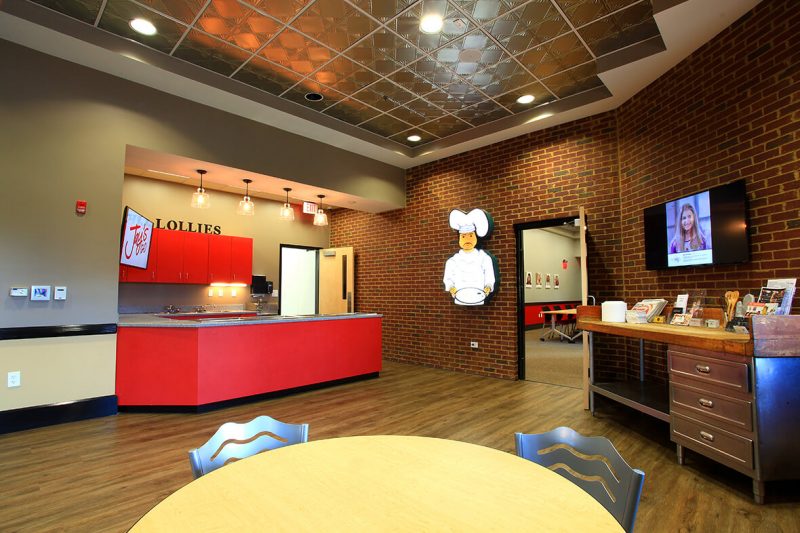
The image size is (800, 533). In order to click on door in this screenshot , I will do `click(586, 254)`, `click(336, 269)`.